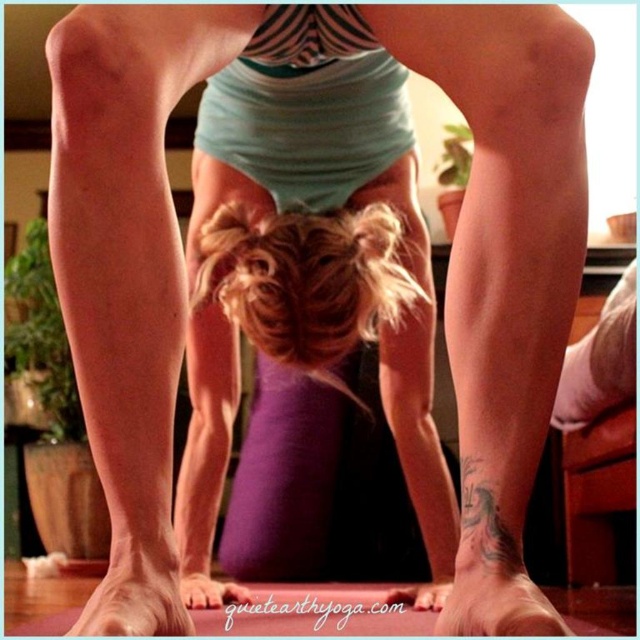
You are a photographer setting up a shoot in a living room. You need to position a small prop between the smooth skin leg at lower center and the smooth skin foot at lower center. Based on their sizes, which object should the prop be closer to?

The smooth skin leg at lower center is larger than the smooth skin foot at lower center, so the prop should be placed closer to the smooth skin foot at lower center to maintain balance.

You are a photographer trying to capture the perfect shot of the person in the downward dog yoga pose. You want to focus on the blonde hair at center. Based on the coordinates provided, can you confirm if the point at (308, 276) is the correct location to focus on?

Yes, the point at (308, 276) corresponds to the blonde hair at center, so focusing there would capture the desired area.

You are a photographer setting up a shoot in this living room. You need to ensure that the blonde hair at center and the smooth skin leg at lower left are both visible in the frame. Based on their sizes, which object should you prioritize keeping within the camera frame?

The blonde hair at center should be prioritized within the camera frame since it is larger in size than the smooth skin leg at lower left, making it more prominent and easier to capture clearly.